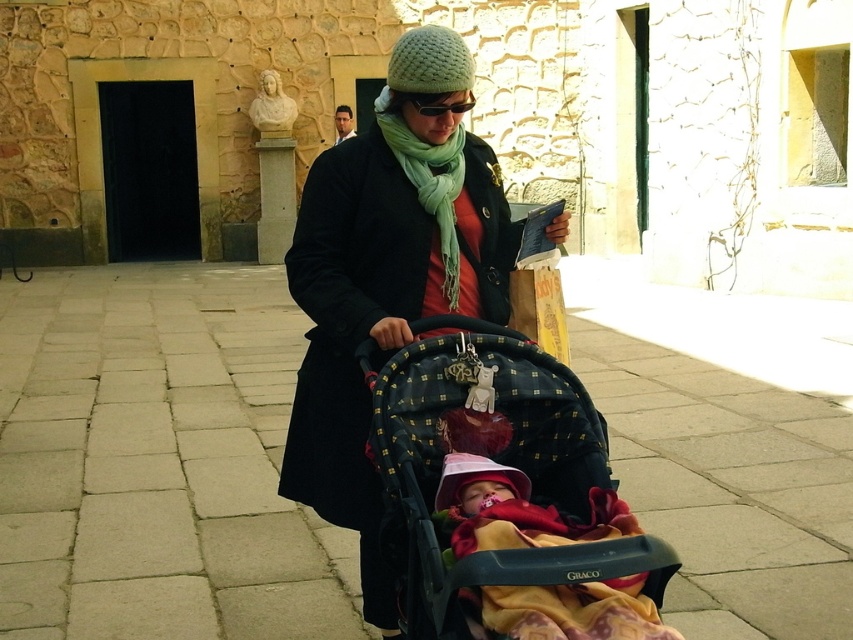
Can you confirm if matte black coat at center is positioned below soft pink fabric at center?

Incorrect, matte black coat at center is not positioned below soft pink fabric at center.

Who is lower down, matte black coat at center or soft pink fabric at center?

soft pink fabric at center is lower down.

This screenshot has width=853, height=640. What do you see at coordinates (386, 292) in the screenshot? I see `matte black coat at center` at bounding box center [386, 292].

I want to click on matte black coat at center, so click(386, 292).

Is black textured fabric baby carriage at center bigger than knitted green hat at upper center?

Indeed, black textured fabric baby carriage at center has a larger size compared to knitted green hat at upper center.

Is black textured fabric baby carriage at center positioned in front of knitted green hat at upper center?

That is True.

Who is more forward, [589,429] or [431,76]?

Positioned in front is point [589,429].

The width and height of the screenshot is (853, 640). What are the coordinates of `black textured fabric baby carriage at center` in the screenshot? It's located at (503, 496).

Does soft pink fabric at center have a lesser width compared to knitted green hat at upper center?

In fact, soft pink fabric at center might be wider than knitted green hat at upper center.

Identify the location of soft pink fabric at center. This screenshot has height=640, width=853. (514, 509).